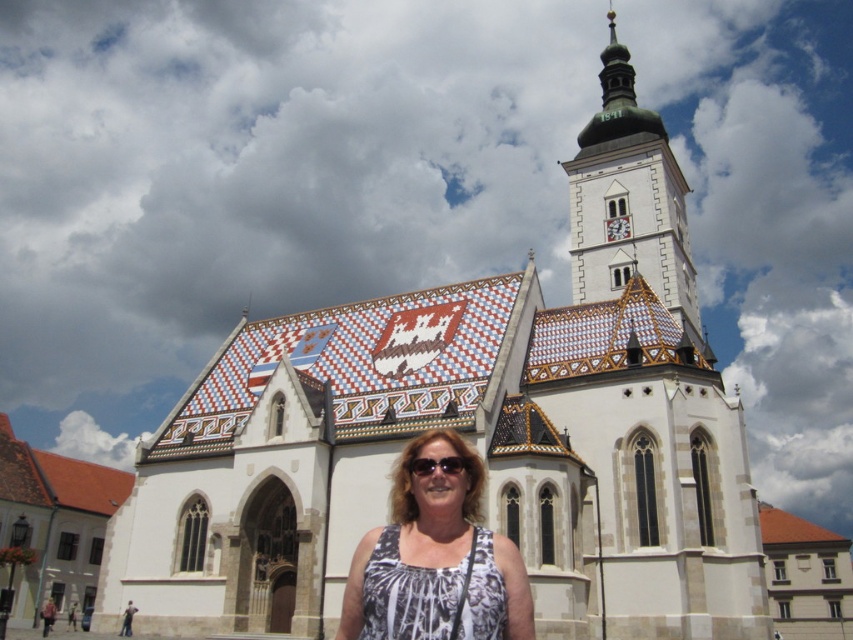
You are standing in front of the church and looking up. You notice the green metallic tower at upper center and the sunglasses at center. Which object is positioned higher in the image?

The green metallic tower at upper center is positioned higher than the sunglasses at center.